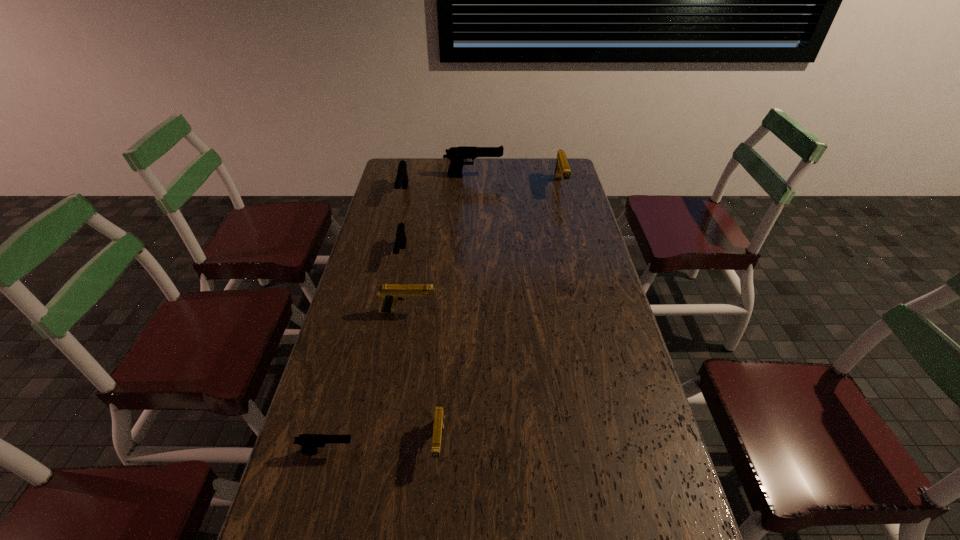
Image resolution: width=960 pixels, height=540 pixels. What are the coordinates of `free space between the smallest tan pistol and the second farthest black pistol` in the screenshot? It's located at (421, 319).

Where is `vacant area that lies between the third nearest pistol and the nearest black pistol`? The width and height of the screenshot is (960, 540). vacant area that lies between the third nearest pistol and the nearest black pistol is located at coordinates (368, 382).

You are a GUI agent. You are given a task and a screenshot of the screen. Output one action in this format:
    pyautogui.click(x=<x>, y=<y>)
    Task: Click on the object that is the sixth closest to the smallest tan pistol
    The width and height of the screenshot is (960, 540).
    Given the screenshot: What is the action you would take?
    pyautogui.click(x=456, y=155)

Locate which object is the second closest to the rightmost pistol. Please provide its 2D coordinates. Your answer should be formatted as a tuple, i.e. [(x, y)], where the tuple contains the x and y coordinates of a point satisfying the conditions above.

[(402, 177)]

Identify the location of pistol that is the second closest to the second smallest black pistol. Image resolution: width=960 pixels, height=540 pixels. (402, 177).

Locate which pistol is the third closest to the second smallest black pistol. Please provide its 2D coordinates. Your answer should be formatted as a tuple, i.e. [(x, y)], where the tuple contains the x and y coordinates of a point satisfying the conditions above.

[(456, 155)]

Find the location of a particular element. The image size is (960, 540). black pistol that stands as the closest to the second tan pistol from left to right is located at coordinates (309, 442).

At what (x,y) coordinates should I click in order to perform the action: click on black pistol that is the fourth closest to the third nearest pistol. Please return your answer as a coordinate pair (x, y). This screenshot has height=540, width=960. Looking at the image, I should click on (456, 155).

Where is `tan pistol that is the second closest to the smallest tan pistol`? The height and width of the screenshot is (540, 960). tan pistol that is the second closest to the smallest tan pistol is located at coordinates (562, 169).

What are the coordinates of `tan pistol that stands as the closest to the second biggest black pistol` in the screenshot? It's located at (390, 294).